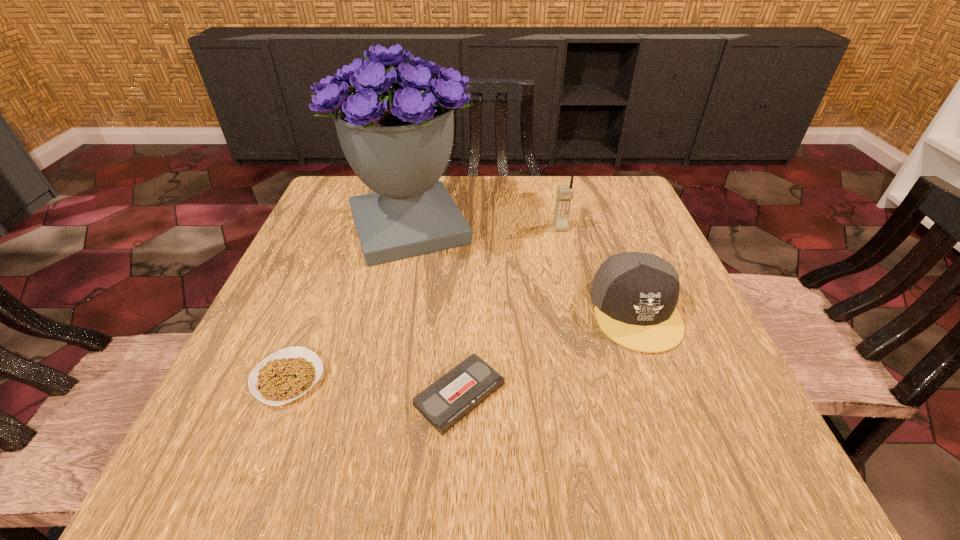
Find the location of a particular element. The height and width of the screenshot is (540, 960). vacant region between the videotape and the cellular telephone is located at coordinates (510, 311).

Find the location of `vacant area that lies between the fourth object from left to right and the tallest object`. vacant area that lies between the fourth object from left to right and the tallest object is located at coordinates (484, 227).

The width and height of the screenshot is (960, 540). Find the location of `unoccupied area between the second tallest object and the third tallest object`. unoccupied area between the second tallest object and the third tallest object is located at coordinates (598, 269).

Where is `vacant region between the third tallest object and the fourth tallest object`? This screenshot has width=960, height=540. vacant region between the third tallest object and the fourth tallest object is located at coordinates (462, 345).

Locate an element on the screen. This screenshot has height=540, width=960. vacant space in between the cap and the fourth object from left to right is located at coordinates (598, 269).

The image size is (960, 540). Identify the location of empty space that is in between the fourth object from left to right and the tallest object. (484, 227).

Locate an element on the screen. This screenshot has height=540, width=960. the fourth closest object relative to the shortest object is located at coordinates (564, 192).

Find the location of a particular element. The height and width of the screenshot is (540, 960). the third closest object relative to the third shortest object is located at coordinates (397, 137).

Locate an element on the screen. This screenshot has width=960, height=540. free space that satisfies the following two spatial constraints: 1. on the front side of the second shortest object; 2. on the right side of the shortest object is located at coordinates (281, 395).